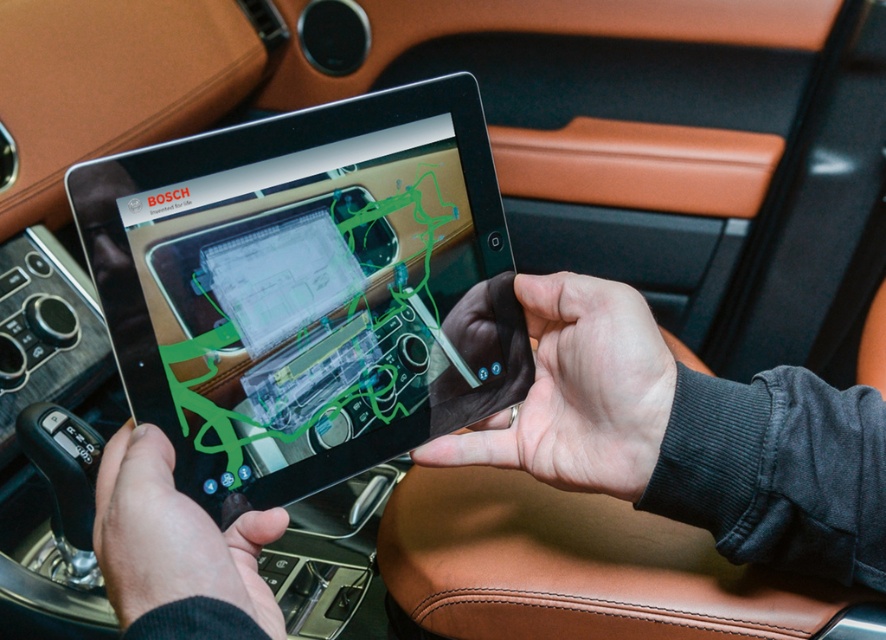
In the scene shown: Who is lower down, black glossy tablet at center or black matte hand at lower left?

Positioned lower is black matte hand at lower left.

Looking at this image, measure the distance between black glossy tablet at center and black matte hand at lower left.

black glossy tablet at center and black matte hand at lower left are 4.41 inches apart.

I want to click on black glossy tablet at center, so click(x=307, y=289).

This screenshot has width=886, height=640. Identify the location of black glossy tablet at center. (307, 289).

Is smooth leather hand at center smaller than black matte hand at lower left?

Incorrect, smooth leather hand at center is not smaller in size than black matte hand at lower left.

In the scene shown: Which of these two, smooth leather hand at center or black matte hand at lower left, stands taller?

smooth leather hand at center

Is point (556, 445) positioned in front of point (138, 556)?

No, it is behind (138, 556).

Identify the location of smooth leather hand at center. (578, 392).

Can you confirm if black glossy tablet at center is smaller than smooth leather hand at center?

Actually, black glossy tablet at center might be larger than smooth leather hand at center.

Is black glossy tablet at center below smooth leather hand at center?

No, black glossy tablet at center is not below smooth leather hand at center.

Is point (496, 211) more distant than point (595, 314)?

Yes, point (496, 211) is behind point (595, 314).

You are a GUI agent. You are given a task and a screenshot of the screen. Output one action in this format:
    pyautogui.click(x=<x>, y=<y>)
    Task: Click on the black glossy tablet at center
    
    Given the screenshot: What is the action you would take?
    point(307,289)